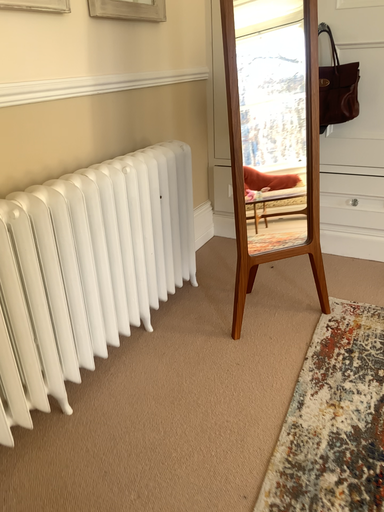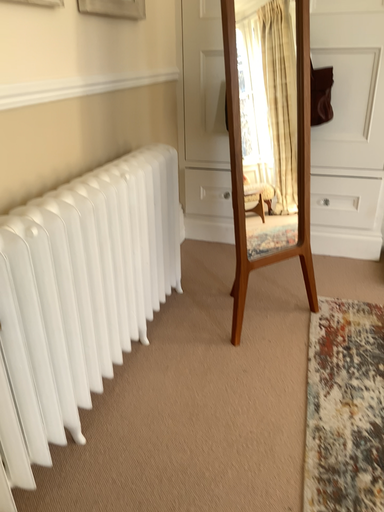
Question: Which way did the camera rotate in the video?

Choices:
 (A) rotated left
 (B) rotated right

Answer: (B)